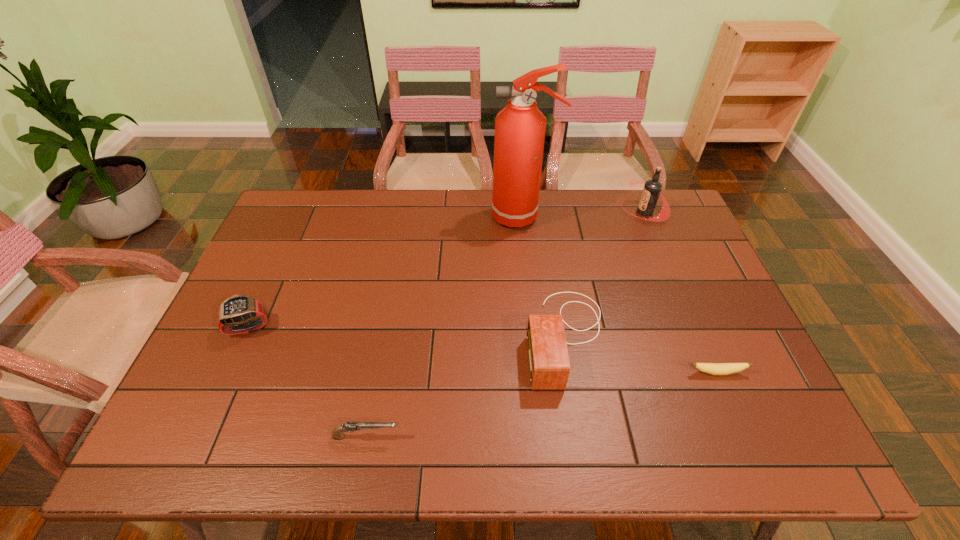
What are the coordinates of `vacant space at the far right corner of the desktop` in the screenshot? It's located at (657, 226).

At what (x,y) coordinates should I click in order to perform the action: click on free spot between the shortest object and the leftmost object. Please return your answer as a coordinate pair (x, y). The width and height of the screenshot is (960, 540). Looking at the image, I should click on (483, 350).

Image resolution: width=960 pixels, height=540 pixels. Find the location of `free spot between the watch and the gun`. free spot between the watch and the gun is located at coordinates (307, 382).

What are the coordinates of `vacant area that lies between the second object from left to right and the fifth shortest object` in the screenshot? It's located at (505, 324).

Find the location of a particular element. free space between the leftmost object and the radio receiver is located at coordinates (407, 332).

At what (x,y) coordinates should I click in order to perform the action: click on free space between the tallest object and the second tallest object. Please return your answer as a coordinate pair (x, y). The height and width of the screenshot is (540, 960). Looking at the image, I should click on (584, 214).

The width and height of the screenshot is (960, 540). Identify the location of blank region between the tallest object and the radio receiver. (544, 277).

Identify the location of vacant area between the banana and the radio receiver. (641, 355).

Find the location of `free space between the shortest object and the fifth tallest object`. free space between the shortest object and the fifth tallest object is located at coordinates (541, 404).

Locate an element on the screen. Image resolution: width=960 pixels, height=540 pixels. unoccupied area between the root beer and the fifth object from right to left is located at coordinates (505, 324).